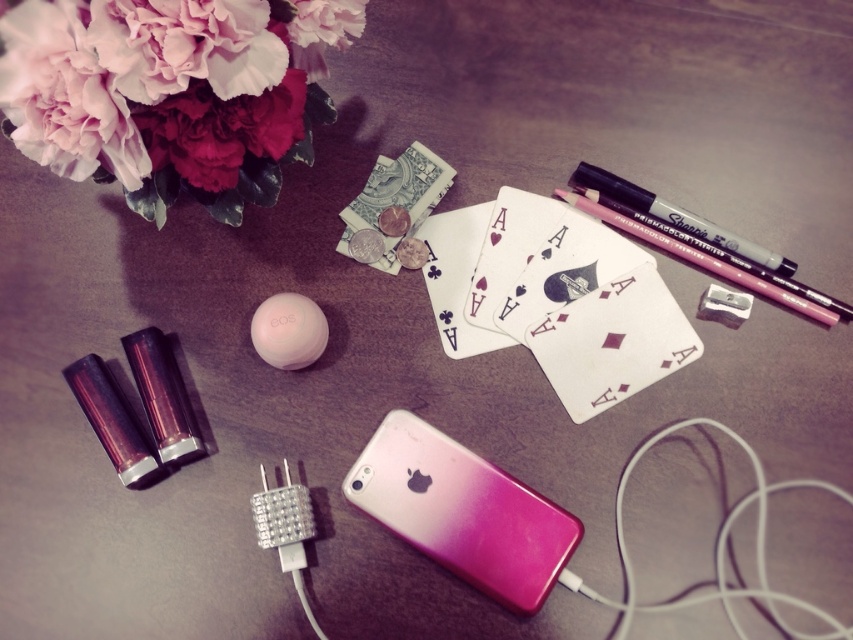
You are organizing items on a desk and need to place the pink matte flower at upper left and the pink gradient plastic ipod at center. Based on their current positions, which item is directly above the other?

The pink matte flower at upper left is positioned over the pink gradient plastic ipod at center, meaning it is directly above the ipod.

You are organizing your desk and want to place the pink gradient plastic ipod at center closer to the matte black marker at upper right. How much space is between them currently?

The pink gradient plastic ipod at center and the matte black marker at upper right are 29.73 centimeters apart from each other.